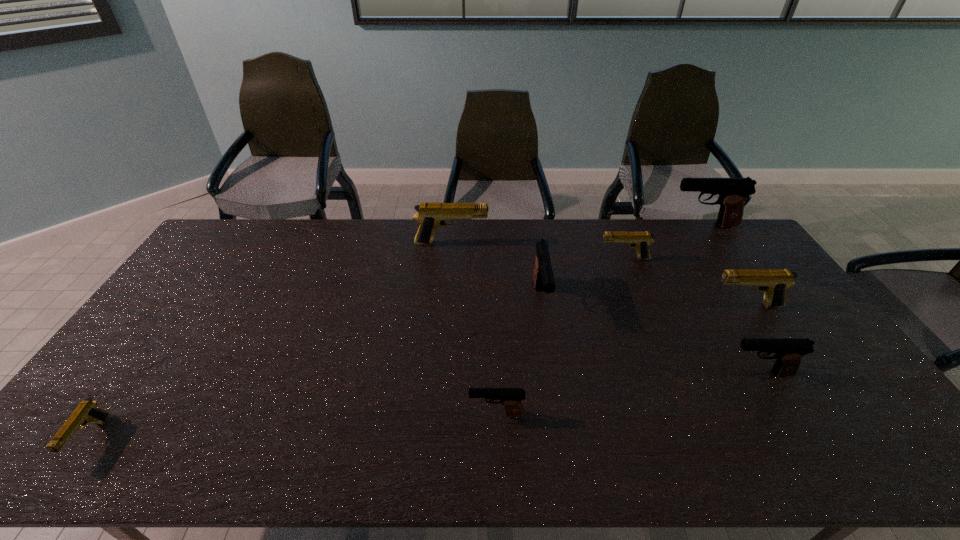
You are a GUI agent. You are given a task and a screenshot of the screen. Output one action in this format:
    pyautogui.click(x=<x>, y=<y>)
    Task: Click on the fourth object from right to left
    This screenshot has width=960, height=540.
    Given the screenshot: What is the action you would take?
    pyautogui.click(x=641, y=240)

At what (x,y) coordinates should I click in order to perform the action: click on the third farthest pistol. Please return your answer as a coordinate pair (x, y). This screenshot has height=540, width=960. Looking at the image, I should click on (641, 240).

Find the location of `the leftmost black pistol`. the leftmost black pistol is located at coordinates coord(511,398).

Locate an element on the screen. the smallest black pistol is located at coordinates [x=511, y=398].

At what (x,y) coordinates should I click in order to perform the action: click on the shortest pistol. Please return your answer as a coordinate pair (x, y). The height and width of the screenshot is (540, 960). Looking at the image, I should click on (87, 411).

This screenshot has height=540, width=960. Find the location of `the leftmost tan pistol`. the leftmost tan pistol is located at coordinates (87, 411).

This screenshot has height=540, width=960. I want to click on free space located at the barrel of the biggest black pistol, so click(642, 226).

The width and height of the screenshot is (960, 540). I want to click on free space located 0.100m at the barrel of the biggest black pistol, so click(x=642, y=226).

This screenshot has width=960, height=540. I want to click on vacant space located at the barrel of the biggest black pistol, so click(x=630, y=226).

This screenshot has width=960, height=540. Find the location of `vacant space situated 0.320m at the barrel of the fifth pistol from right to left`. vacant space situated 0.320m at the barrel of the fifth pistol from right to left is located at coordinates (560, 423).